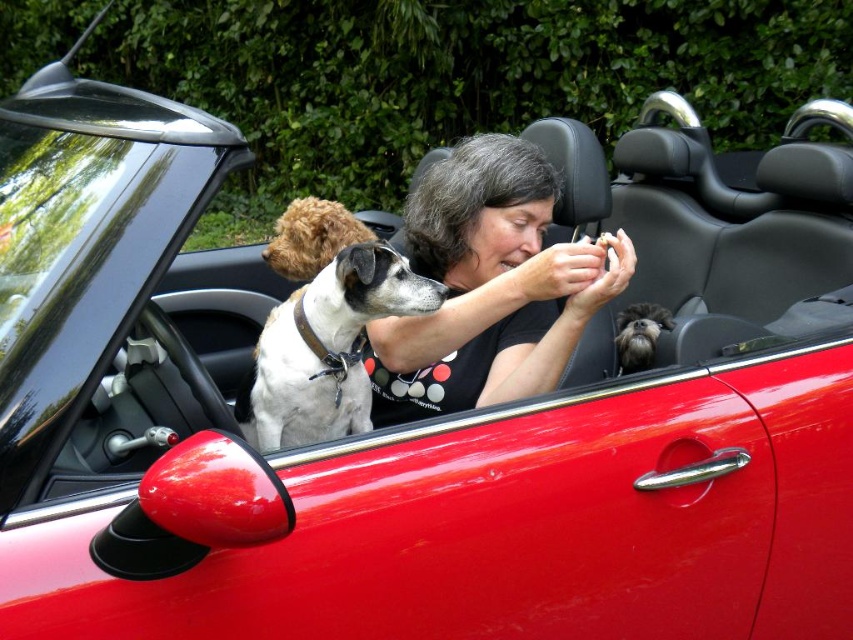
Can you confirm if white fur dog at center is wider than shaggy black fur at center?

Correct, the width of white fur dog at center exceeds that of shaggy black fur at center.

Who is taller, white fur dog at center or shaggy black fur at center?

Standing taller between the two is white fur dog at center.

Which is in front, point (323, 353) or point (637, 339)?

Positioned in front is point (323, 353).

You are a GUI agent. You are given a task and a screenshot of the screen. Output one action in this format:
    pyautogui.click(x=<x>, y=<y>)
    Task: Click on the white fur dog at center
    This screenshot has height=640, width=853.
    Given the screenshot: What is the action you would take?
    pyautogui.click(x=326, y=348)

Does black matte shirt at center have a greater width compared to shaggy black fur at center?

Correct, the width of black matte shirt at center exceeds that of shaggy black fur at center.

Who is taller, black matte shirt at center or shaggy black fur at center?

black matte shirt at center

I want to click on black matte shirt at center, so click(489, 285).

Measure the distance between shiny brown fur at center and shaggy black fur at center.

The distance of shiny brown fur at center from shaggy black fur at center is 26.30 inches.

Who is more forward, (355, 228) or (618, 323)?

Point (355, 228)

Is point (286, 227) more distant than point (624, 352)?

That is True.

You are a GUI agent. You are given a task and a screenshot of the screen. Output one action in this format:
    pyautogui.click(x=<x>, y=<y>)
    Task: Click on the shiny brown fur at center
    The image size is (853, 640).
    Given the screenshot: What is the action you would take?
    pyautogui.click(x=311, y=236)